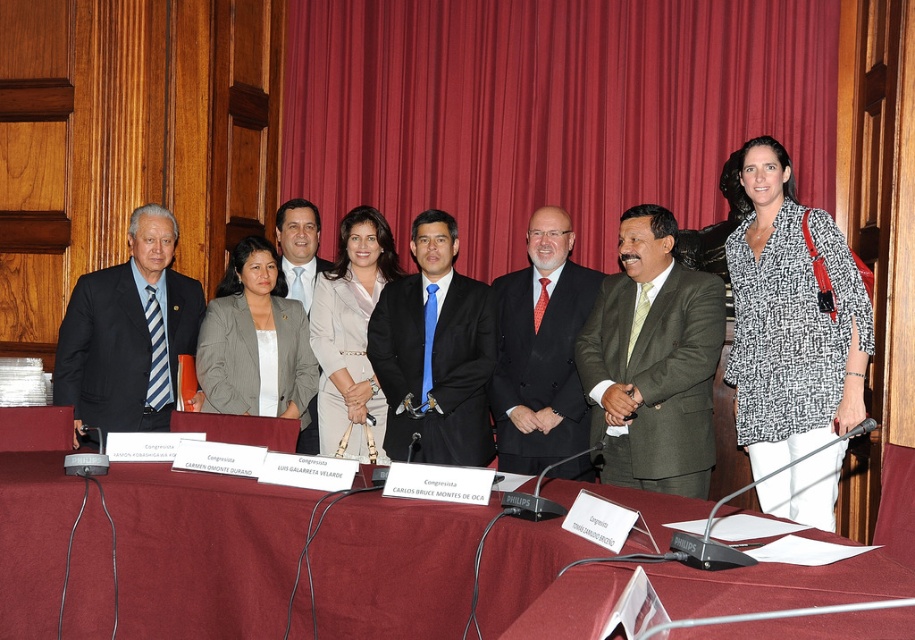
Question: Can you confirm if red velvet curtain at upper center is wider than black satin suit at center?

Choices:
 (A) no
 (B) yes

Answer: (B)

Question: Among these objects, which one is farthest from the camera?

Choices:
 (A) light beige suit at center
 (B) green textured suit at center

Answer: (A)

Question: Is green textured suit at center above matte black suit at left?

Choices:
 (A) no
 (B) yes

Answer: (A)

Question: Which point appears closest to the camera in this image?

Choices:
 (A) (299, 292)
 (B) (612, 332)
 (C) (147, 474)
 (D) (305, 225)

Answer: (C)

Question: Estimate the real-world distances between objects in this image. Which object is farther from the matte black suit at center?

Choices:
 (A) matte black suit at left
 (B) light beige suit at center

Answer: (A)

Question: Can you confirm if printed cotton blouse at center is wider than matte gray blazer at center?

Choices:
 (A) yes
 (B) no

Answer: (B)